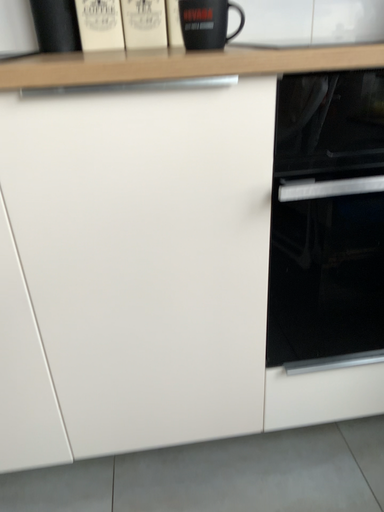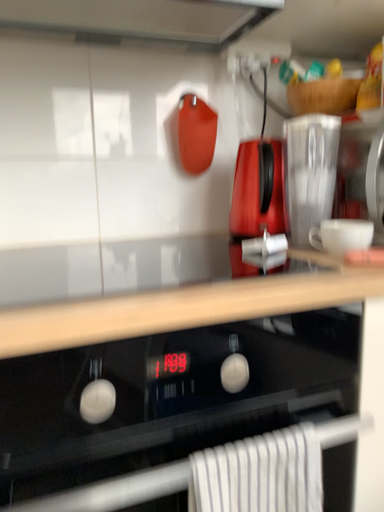
Question: Which way did the camera rotate in the video?

Choices:
 (A) rotated upward
 (B) rotated downward

Answer: (A)